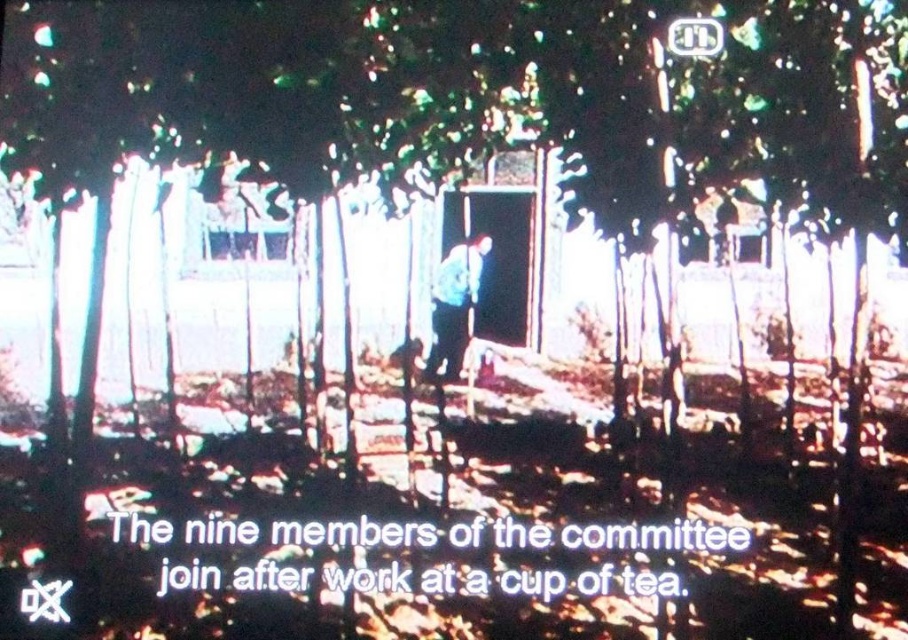
Question: Is blue denim jacket at center to the left of metallic rectangular at upper center from the viewer's perspective?

Choices:
 (A) no
 (B) yes

Answer: (B)

Question: Does blue denim jacket at center appear on the right side of metallic rectangular at upper center?

Choices:
 (A) yes
 (B) no

Answer: (B)

Question: Among these objects, which one is farthest from the camera?

Choices:
 (A) metallic rectangular at upper center
 (B) blue denim jacket at center

Answer: (A)

Question: Is blue denim jacket at center above metallic rectangular at upper center?

Choices:
 (A) yes
 (B) no

Answer: (B)